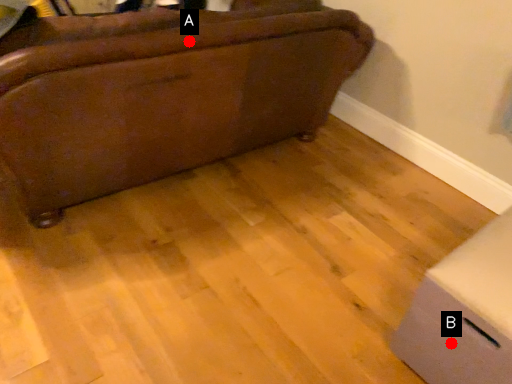
Question: Two points are circled on the image, labeled by A and B beside each circle. Which point is closer to the camera?

Choices:
 (A) A is closer
 (B) B is closer

Answer: (B)